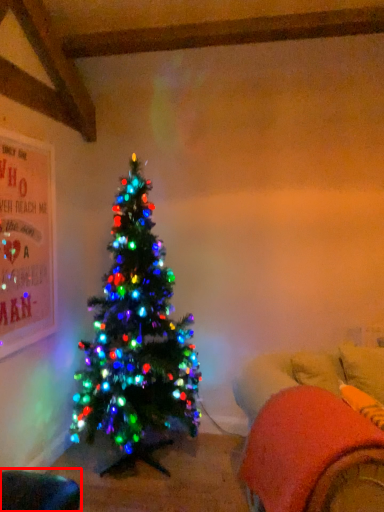
Question: Considering the relative positions of bean bag chair (annotated by the red box) and bean bag chair in the image provided, where is bean bag chair (annotated by the red box) located with respect to the staircase?

Choices:
 (A) right
 (B) left

Answer: (B)